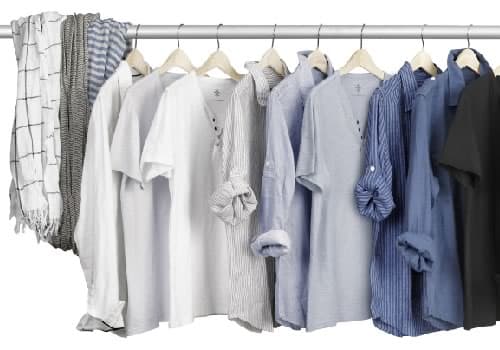
Where is `hangers`? hangers is located at coordinates (137, 62), (171, 61), (215, 62), (269, 58), (312, 58), (356, 59), (415, 61), (467, 56).